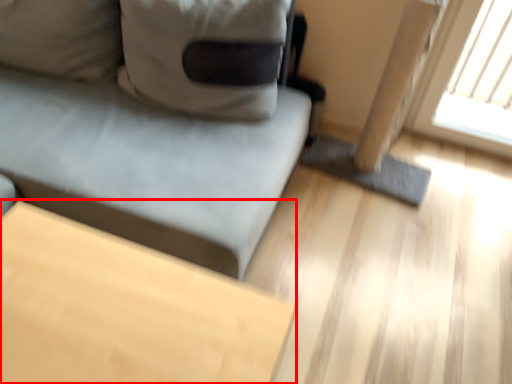
Question: Where is table (annotated by the red box) located in relation to studio couch in the image?

Choices:
 (A) right
 (B) left

Answer: (A)